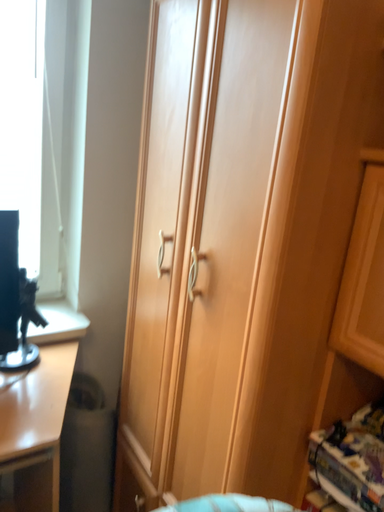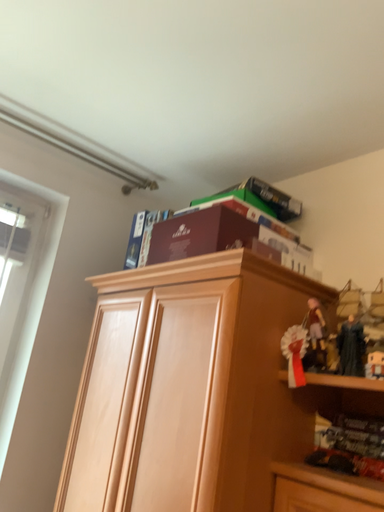
Question: Which way did the camera rotate in the video?

Choices:
 (A) rotated upward
 (B) rotated downward

Answer: (A)